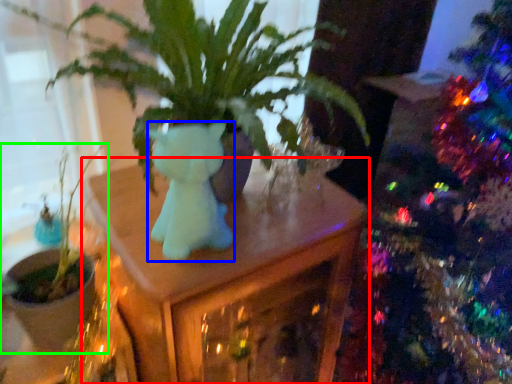
Question: Based on their relative distances, which object is farther from table (highlighted by a red box)? Choose from animal (highlighted by a blue box) and houseplant (highlighted by a green box).

Choices:
 (A) animal
 (B) houseplant

Answer: (B)